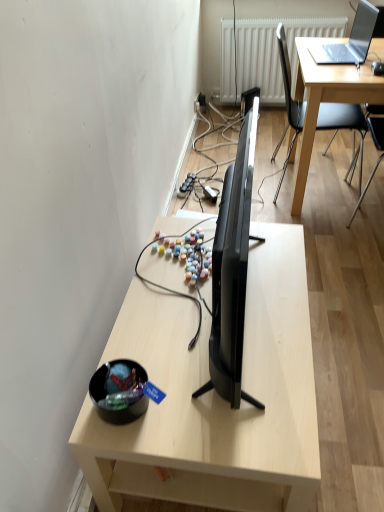
Identify the location of vacant area in front of sleek silver laptop at upper right. The image size is (384, 512). (344, 70).